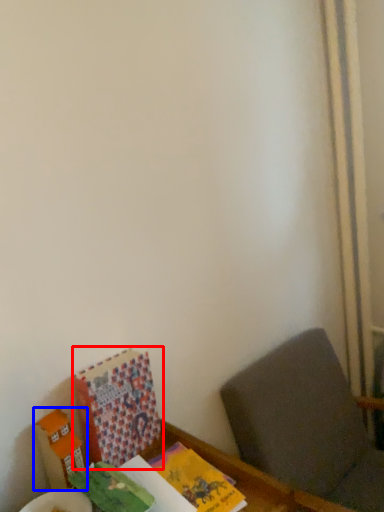
Question: Which of the following is the closest to the observer, book (highlighted by a red box) or cardboard box (highlighted by a blue box)?

Choices:
 (A) book
 (B) cardboard box

Answer: (B)